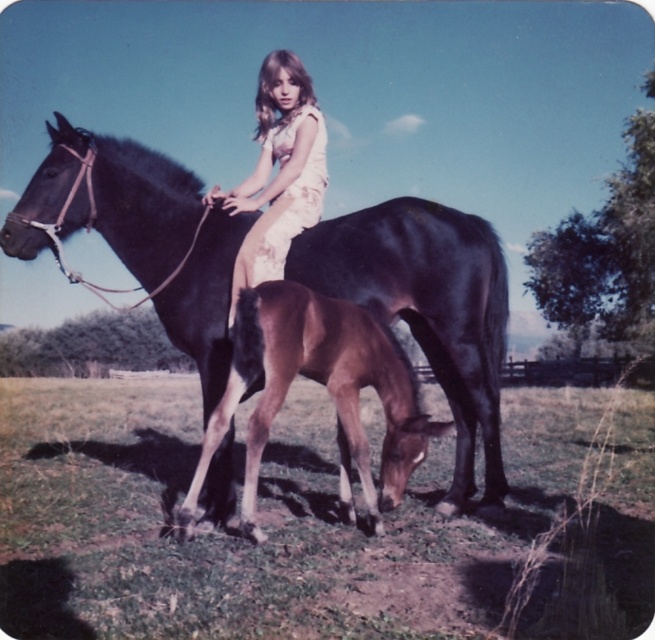
Question: Which point is closer to the camera?

Choices:
 (A) matte floral dress at center
 (B) shiny dark brown horse at center

Answer: (A)

Question: Considering the relative positions of shiny dark brown horse at center and matte floral dress at center in the image provided, where is shiny dark brown horse at center located with respect to matte floral dress at center?

Choices:
 (A) below
 (B) above

Answer: (A)

Question: Which object is closer to the camera taking this photo?

Choices:
 (A) shiny dark brown horse at center
 (B) matte floral dress at center

Answer: (B)

Question: Which of the following is the closest to the observer?

Choices:
 (A) shiny dark brown horse at center
 (B) matte floral dress at center

Answer: (B)

Question: Can you confirm if shiny dark brown horse at center is positioned to the right of matte floral dress at center?

Choices:
 (A) yes
 (B) no

Answer: (A)

Question: Can you confirm if shiny dark brown horse at center is positioned to the right of matte floral dress at center?

Choices:
 (A) yes
 (B) no

Answer: (A)